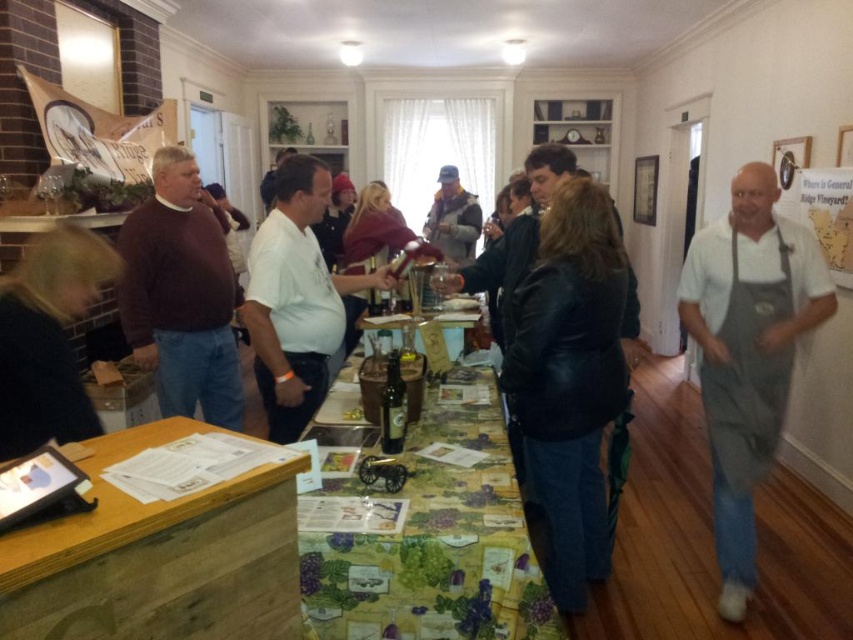
Is gray fabric apron at right wider than translucent glass bottles at center?

In fact, gray fabric apron at right might be narrower than translucent glass bottles at center.

At what (x,y) coordinates should I click in order to perform the action: click on gray fabric apron at right. Please return your answer as a coordinate pair (x, y). The width and height of the screenshot is (853, 640). Looking at the image, I should click on (747, 376).

Is point (751, 474) closer to viewer compared to point (399, 321)?

Yes, it is.

Locate an element on the screen. The width and height of the screenshot is (853, 640). gray fabric apron at right is located at coordinates (747, 376).

The image size is (853, 640). What do you see at coordinates (160, 557) in the screenshot? I see `wooden table at lower left` at bounding box center [160, 557].

Between wooden table at lower left and gray fleece jacket at center, which one is positioned lower?

wooden table at lower left

Is point (151, 513) positioned after point (469, 204)?

No, (151, 513) is closer to viewer.

Where is `wooden table at lower left`? Image resolution: width=853 pixels, height=640 pixels. wooden table at lower left is located at coordinates (160, 557).

Is printed fabric tablecloth at center thinner than translucent glass bottles at center?

Incorrect, printed fabric tablecloth at center's width is not less than translucent glass bottles at center's.

Between printed fabric tablecloth at center and translucent glass bottles at center, which one is positioned lower?

printed fabric tablecloth at center is below.

Between point (456, 572) and point (399, 323), which one is positioned behind?

The point (399, 323) is more distant.

At what (x,y) coordinates should I click in order to perform the action: click on printed fabric tablecloth at center. Please return your answer as a coordinate pair (x, y). This screenshot has height=640, width=853. Looking at the image, I should click on (428, 536).